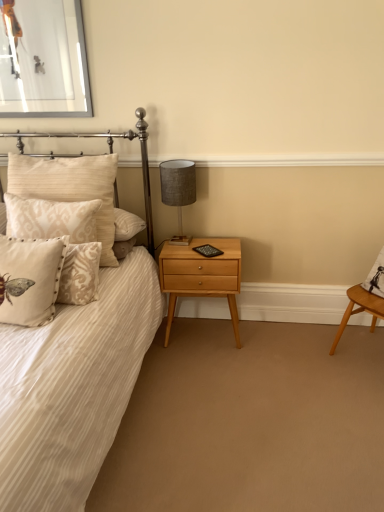
Locate an element on the screen. vacant space situated above textured gray lampshade at upper right (from a real-world perspective) is located at coordinates (172, 162).